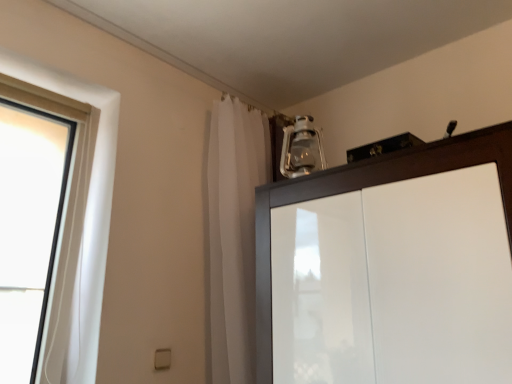
Question: Considering their positions, is white sheer curtain at upper center located in front of or behind clear glass lantern at upper center?

Choices:
 (A) behind
 (B) front

Answer: (B)

Question: Does point (251, 231) appear closer or farther from the camera than point (318, 145)?

Choices:
 (A) farther
 (B) closer

Answer: (B)

Question: Estimate the real-world distances between objects in this image. Which object is farther from the white sheer curtain at upper center?

Choices:
 (A) clear glass lantern at upper center
 (B) glossy wood cupboard at upper right

Answer: (B)

Question: Which is farther from the clear glass lantern at upper center?

Choices:
 (A) white sheer curtain at upper center
 (B) glossy wood cupboard at upper right

Answer: (B)